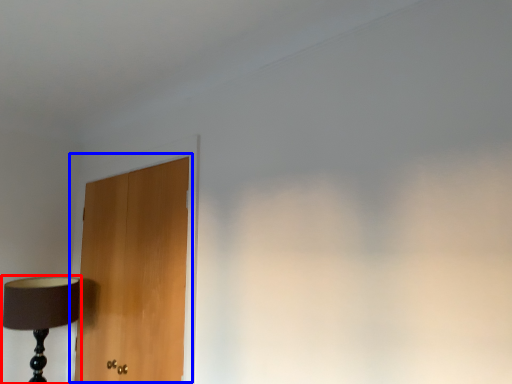
Question: Which of the following is the closest to the observer, lamp (highlighted by a red box) or door (highlighted by a blue box)?

Choices:
 (A) lamp
 (B) door

Answer: (B)